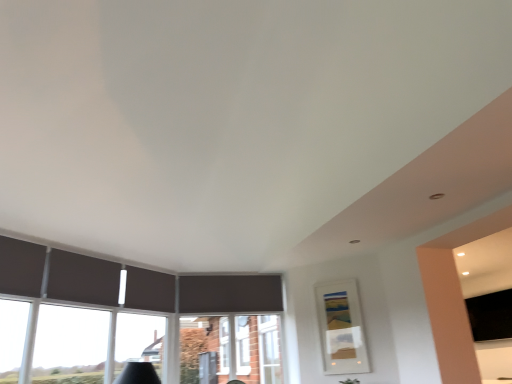
Question: Is point (117, 329) closer or farther from the camera than point (494, 337)?

Choices:
 (A) farther
 (B) closer

Answer: (A)

Question: Based on their sizes in the image, would you say transparent glass window at lower left is bigger or smaller than black matte tv at right?

Choices:
 (A) big
 (B) small

Answer: (B)

Question: Which is nearer to the white plastic window frame at center?

Choices:
 (A) black matte tv at right
 (B) transparent glass window at lower left
 (C) matte white picture frame at center-right

Answer: (C)

Question: Estimate the real-world distances between objects in this image. Which object is farther from the transparent glass window at lower left?

Choices:
 (A) black matte tv at right
 (B) matte white picture frame at center-right
 (C) white plastic window frame at center

Answer: (A)